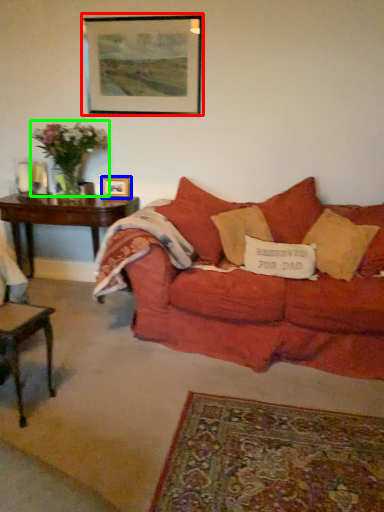
Question: Based on their relative distances, which object is farther from picture frame (highlighted by a red box)? Choose from picture frame (highlighted by a blue box) and flower (highlighted by a green box).

Choices:
 (A) picture frame
 (B) flower

Answer: (A)